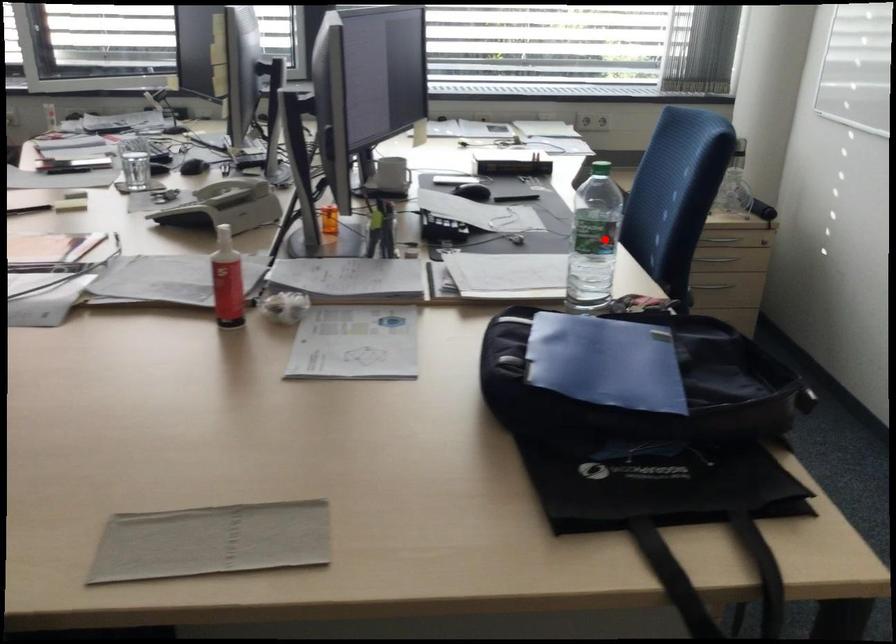
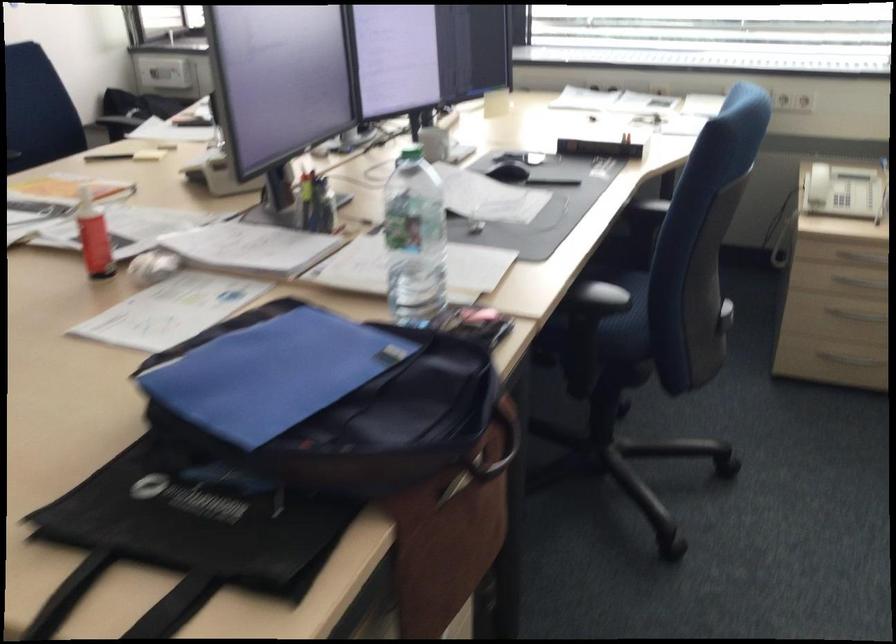
Find the pixel in the second image that matches the highlighted location in the first image.

(415, 240)